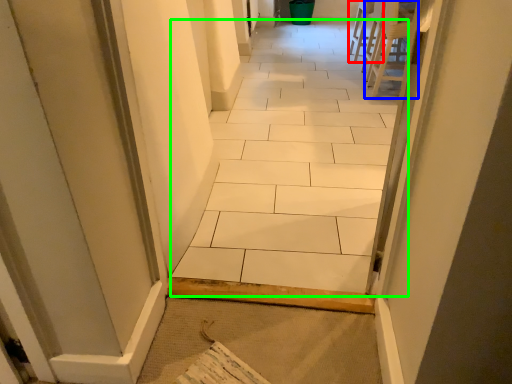
Question: Which is farther away from chair (highlighted by a red box)? chair (highlighted by a blue box) or ceramic tile (highlighted by a green box)?

Choices:
 (A) chair
 (B) ceramic tile

Answer: (B)